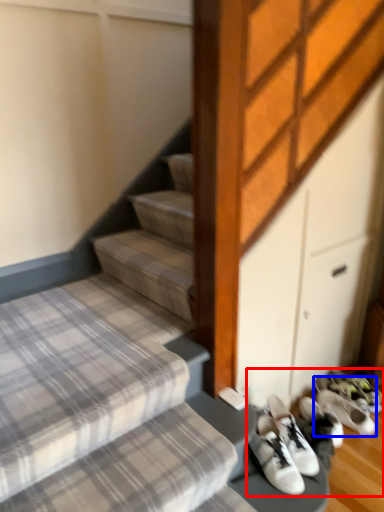
Question: Which of the following is the farthest to the observer, footwear (highlighted by a red box) or footwear (highlighted by a blue box)?

Choices:
 (A) footwear
 (B) footwear

Answer: (B)